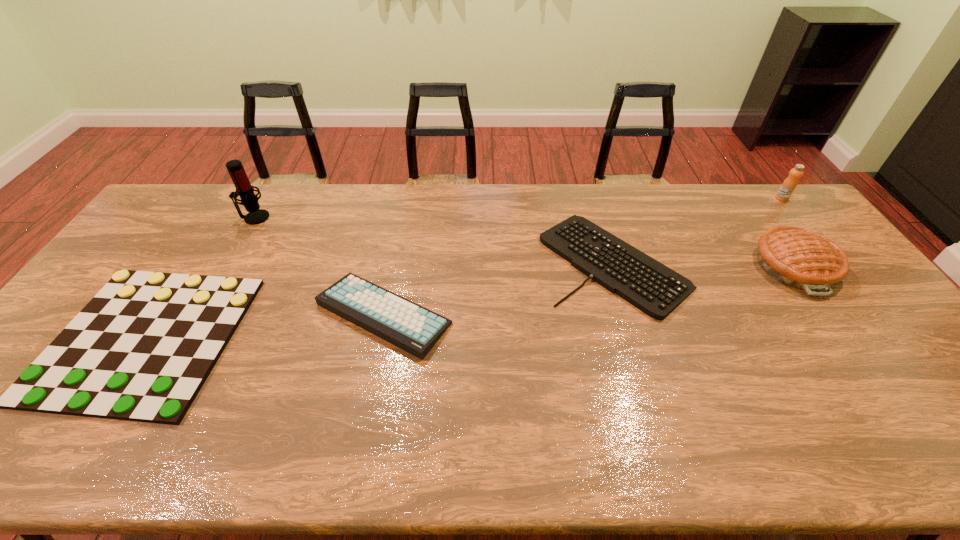
In the image, there is a desktop. At what (x,y) coordinates should I click in order to perform the action: click on vacant space at the near edge. Please return your answer as a coordinate pair (x, y). The width and height of the screenshot is (960, 540). Looking at the image, I should click on (74, 437).

The height and width of the screenshot is (540, 960). In the image, there is a desktop. What are the coordinates of `free space at the far right corner` in the screenshot? It's located at (782, 205).

Where is `vacant area that lies between the fourth object from left to right and the fifth shortest object`? The height and width of the screenshot is (540, 960). vacant area that lies between the fourth object from left to right and the fifth shortest object is located at coordinates (698, 230).

This screenshot has height=540, width=960. I want to click on empty space that is in between the right computer keyboard and the tallest object, so click(x=434, y=240).

Identify the location of free spot between the farthest object and the third object from right to left. (698, 230).

The image size is (960, 540). What are the coordinates of `vacant space in between the fourth shortest object and the shorter computer keyboard` in the screenshot? It's located at (704, 264).

This screenshot has height=540, width=960. Find the location of `vacant region between the right computer keyboard and the tallest object`. vacant region between the right computer keyboard and the tallest object is located at coordinates (434, 240).

Identify the location of free area in between the tallest object and the fifth shortest object. (518, 208).

Locate an element on the screen. This screenshot has height=540, width=960. free space that is in between the fifth shortest object and the microphone is located at coordinates (518, 208).

Where is `blank region between the farthest object and the tallest object`? This screenshot has height=540, width=960. blank region between the farthest object and the tallest object is located at coordinates (518, 208).